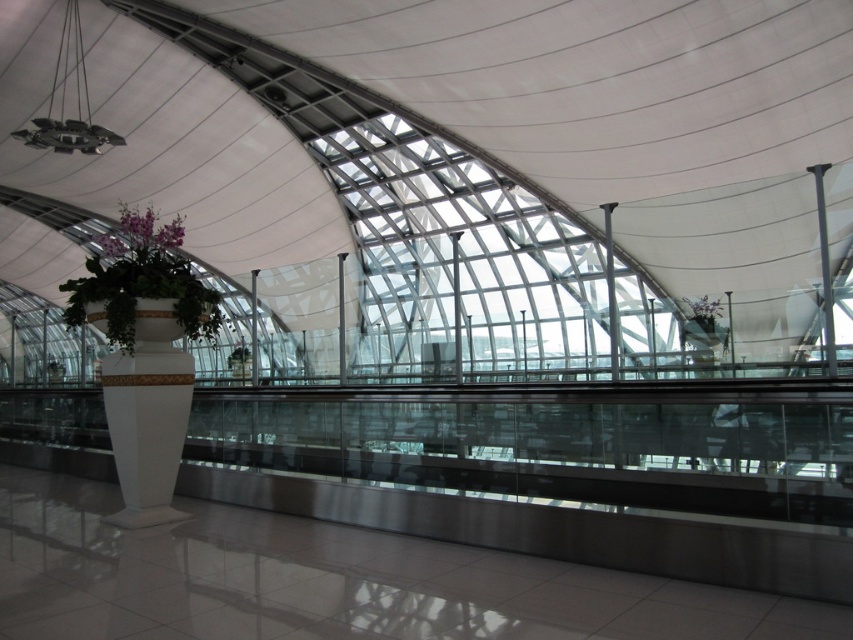
Question: Does white glossy pillar at center have a smaller size compared to purple matte orchid at upper left?

Choices:
 (A) yes
 (B) no

Answer: (A)

Question: Which object is positioned farthest from the white glossy pillar at center?

Choices:
 (A) purple matte orchid at upper left
 (B) white glossy planter at center

Answer: (B)

Question: Considering the real-world distances, which object is closest to the purple matte orchid at upper left?

Choices:
 (A) white glossy planter at center
 (B) white glossy pillar at center
 (C) purple matte flower at upper right

Answer: (A)

Question: Observing the image, what is the correct spatial positioning of white glossy planter at center in reference to purple matte flower at upper right?

Choices:
 (A) above
 (B) below

Answer: (A)

Question: Can you confirm if white glossy pillar at center is positioned above white glossy planter at center?

Choices:
 (A) yes
 (B) no

Answer: (B)

Question: Among these points, which one is farthest from the camera?

Choices:
 (A) (163, 236)
 (B) (136, 240)
 (C) (102, 371)
 (D) (705, 316)

Answer: (D)